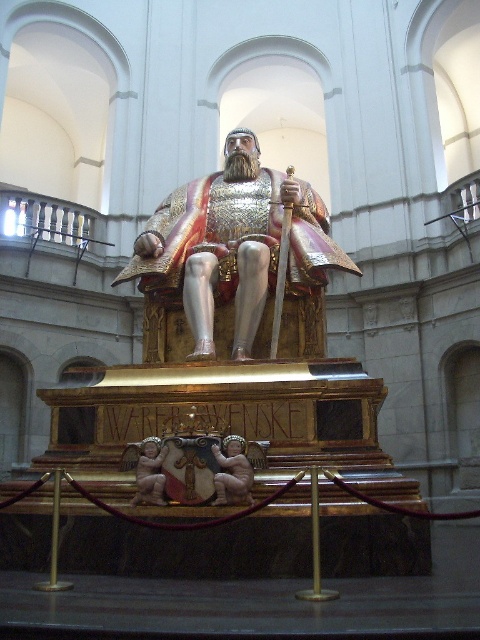
Can you confirm if shiny gold armor at center is smaller than polished bronze cherub at center?

No, shiny gold armor at center is not smaller than polished bronze cherub at center.

Can you confirm if shiny gold armor at center is taller than polished bronze cherub at center?

Correct, shiny gold armor at center is much taller as polished bronze cherub at center.

You are a GUI agent. You are given a task and a screenshot of the screen. Output one action in this format:
    pyautogui.click(x=<x>, y=<y>)
    Task: Click on the shiny gold armor at center
    
    Given the screenshot: What is the action you would take?
    pyautogui.click(x=236, y=262)

Between polished bronze cherub at center and matte gold cherub at center, which one has less height?

polished bronze cherub at center is shorter.

Does polished bronze cherub at center appear on the right side of matte gold cherub at center?

Correct, you'll find polished bronze cherub at center to the right of matte gold cherub at center.

Describe the element at coordinates (232, 472) in the screenshot. I see `polished bronze cherub at center` at that location.

Locate an element on the screen. Image resolution: width=480 pixels, height=640 pixels. polished bronze cherub at center is located at coordinates (232, 472).

Can you confirm if shiny gold armor at center is positioned to the right of matte gold cherub at center?

Indeed, shiny gold armor at center is positioned on the right side of matte gold cherub at center.

Which is below, shiny gold armor at center or matte gold cherub at center?

matte gold cherub at center

What do you see at coordinates (236, 262) in the screenshot? I see `shiny gold armor at center` at bounding box center [236, 262].

Where is `shiny gold armor at center`? This screenshot has width=480, height=640. shiny gold armor at center is located at coordinates (236, 262).